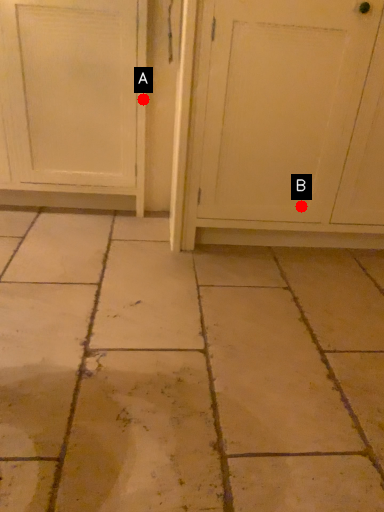
Question: Two points are circled on the image, labeled by A and B beside each circle. Which point appears closest to the camera in this image?

Choices:
 (A) A is closer
 (B) B is closer

Answer: (B)